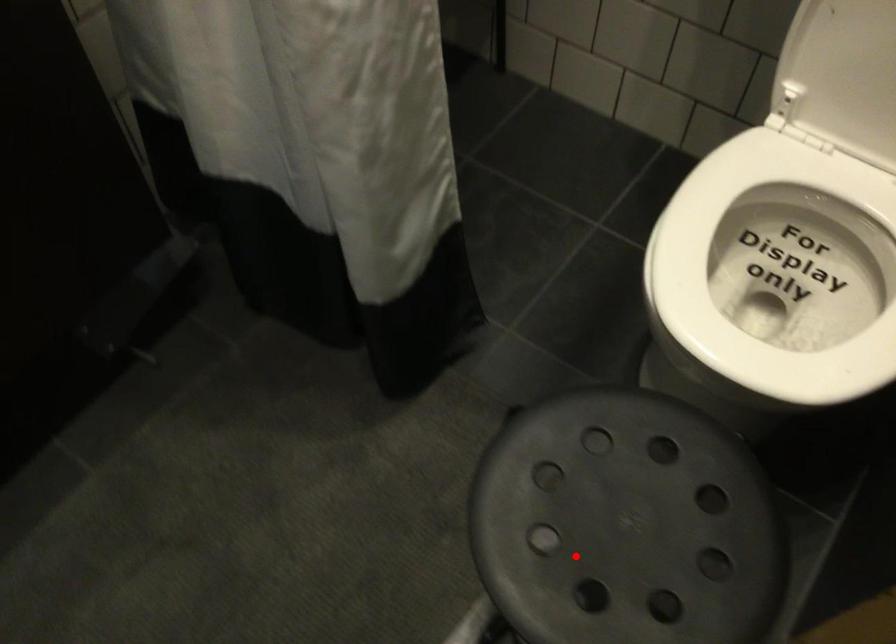
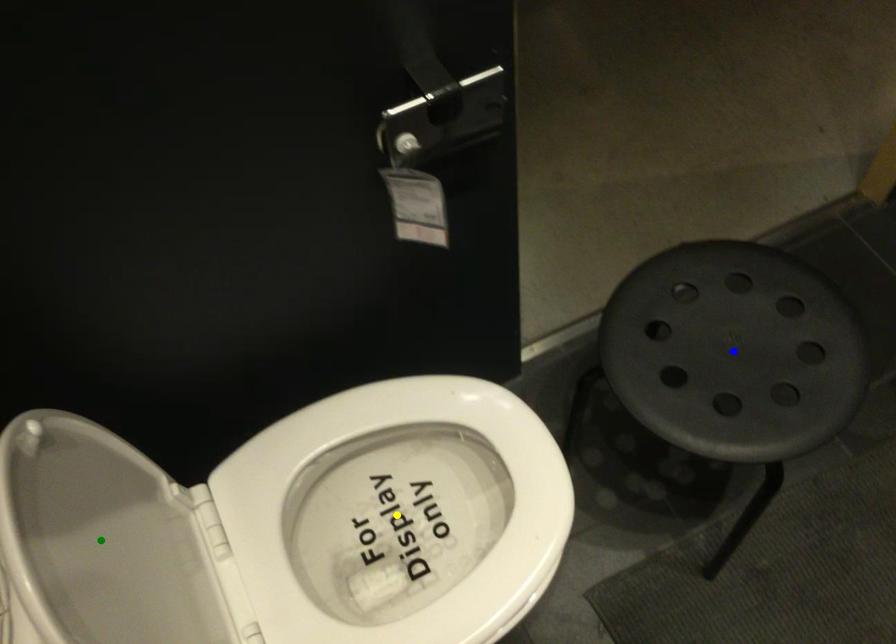
Question: I am providing you with two images of the same scene from different viewpoints. A red point is marked on the first image. You are given multiple points on the second image. Which spot in image 2 lines up with the point in image 1?

Choices:
 (A) yellow point
 (B) green point
 (C) blue point

Answer: (C)